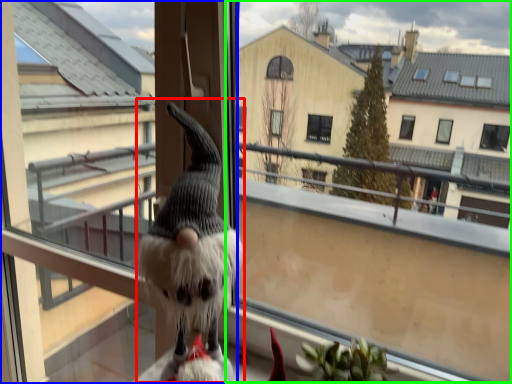
Question: Which is nearer to the animal (highlighted by a red box)? screen door (highlighted by a blue box) or window screen (highlighted by a green box).

Choices:
 (A) screen door
 (B) window screen

Answer: (A)